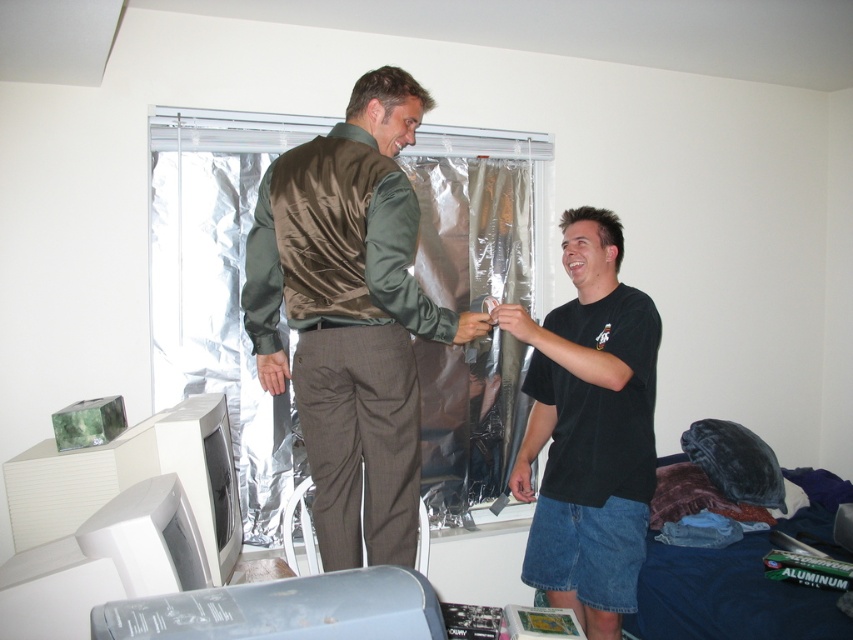
You are standing in the room shown in the image and want to place a small object between the two points labeled point (271,296) and point (611,497). Based on their positions, which point should the object be closer to?

The object should be placed closer to point (271,296) because it is in front of point (611,497).